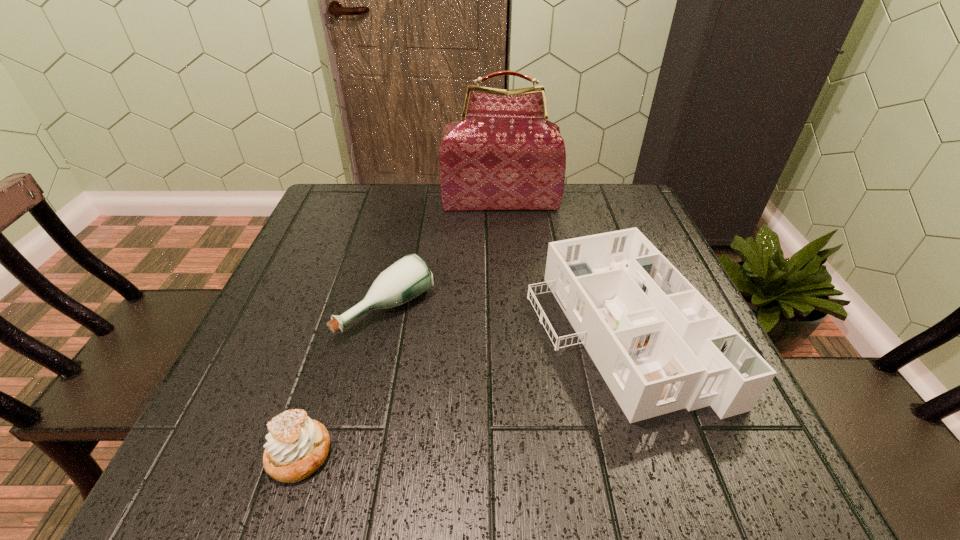
This screenshot has width=960, height=540. I want to click on free point that satisfies the following two spatial constraints: 1. on the front-facing side of the third shortest object; 2. on the right side of the handbag, so click(510, 329).

You are a GUI agent. You are given a task and a screenshot of the screen. Output one action in this format:
    pyautogui.click(x=<x>, y=<y>)
    Task: Click on the free point that satisfies the following two spatial constraints: 1. on the front side of the second tallest object; 2. on the left side of the bottle
    The width and height of the screenshot is (960, 540).
    Given the screenshot: What is the action you would take?
    (383, 329)

Find the location of `vacant area that satisfies the following two spatial constraints: 1. on the front-facing side of the third shortest object; 2. on the right side of the farthest object`. vacant area that satisfies the following two spatial constraints: 1. on the front-facing side of the third shortest object; 2. on the right side of the farthest object is located at coordinates (510, 329).